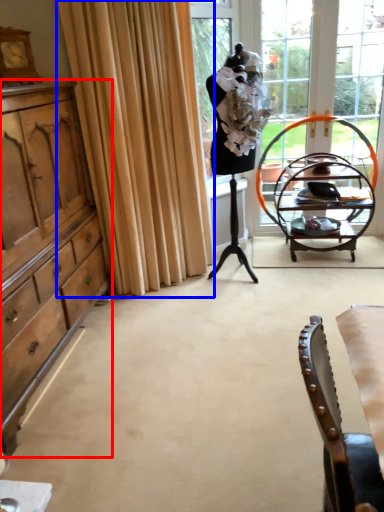
Question: Which object appears farthest to the camera in this image, cabinetry (highlighted by a red box) or curtain (highlighted by a blue box)?

Choices:
 (A) cabinetry
 (B) curtain

Answer: (B)